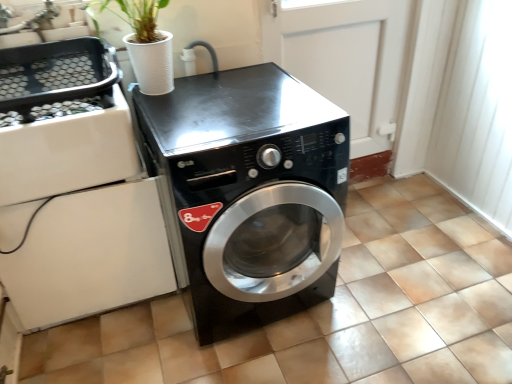
Question: Would you say black glossy washing machine at center is part of white glossy door at center's contents?

Choices:
 (A) yes
 (B) no

Answer: (B)

Question: Does white glossy door at center have a greater height compared to black glossy washing machine at center?

Choices:
 (A) yes
 (B) no

Answer: (A)

Question: Can you confirm if white glossy door at center is smaller than black glossy washing machine at center?

Choices:
 (A) no
 (B) yes

Answer: (B)

Question: Is white glossy door at center positioned in front of black glossy washing machine at center?

Choices:
 (A) yes
 (B) no

Answer: (B)

Question: Considering the relative sizes of white glossy door at center and black glossy washing machine at center in the image provided, is white glossy door at center bigger than black glossy washing machine at center?

Choices:
 (A) yes
 (B) no

Answer: (B)

Question: From a real-world perspective, is white glossy door at center located higher than black glossy washing machine at center?

Choices:
 (A) no
 (B) yes

Answer: (B)

Question: From the image's perspective, does black glossy washing machine at center appear higher than white glossy door at center?

Choices:
 (A) no
 (B) yes

Answer: (A)

Question: Can you confirm if black glossy washing machine at center is bigger than white glossy door at center?

Choices:
 (A) no
 (B) yes

Answer: (B)

Question: Is black glossy washing machine at center taller than white glossy door at center?

Choices:
 (A) yes
 (B) no

Answer: (B)

Question: Is black glossy washing machine at center oriented away from white glossy door at center?

Choices:
 (A) no
 (B) yes

Answer: (A)

Question: Is white glossy door at center completely or partially inside black glossy washing machine at center?

Choices:
 (A) yes
 (B) no

Answer: (B)

Question: Does black glossy washing machine at center have a smaller size compared to white glossy door at center?

Choices:
 (A) yes
 (B) no

Answer: (B)

Question: From their relative heights in the image, would you say black glossy washing machine at center is taller or shorter than white glossy door at center?

Choices:
 (A) short
 (B) tall

Answer: (A)